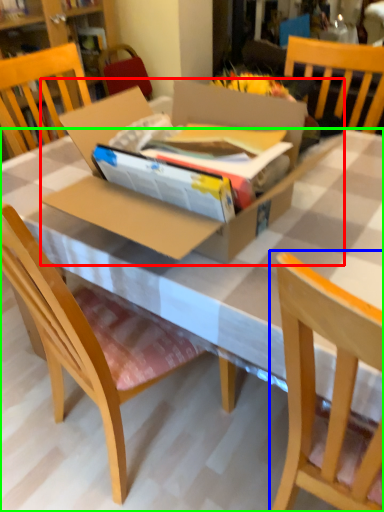
Question: Based on their relative distances, which object is farther from cardboard box (highlighted by a red box)? Choose from chair (highlighted by a blue box) and desk (highlighted by a green box).

Choices:
 (A) chair
 (B) desk

Answer: (A)